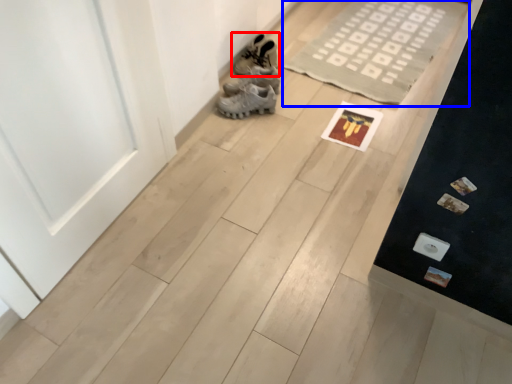
Question: Which of the following is the closest to the observer, footwear (highlighted by a red box) or doormat (highlighted by a blue box)?

Choices:
 (A) footwear
 (B) doormat

Answer: (B)